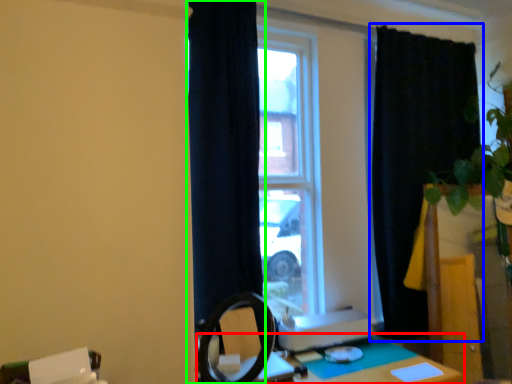
Question: Based on their relative distances, which object is nearer to table (highlighted by a red box)? Choose from curtain (highlighted by a blue box) and curtain (highlighted by a green box).

Choices:
 (A) curtain
 (B) curtain

Answer: (B)